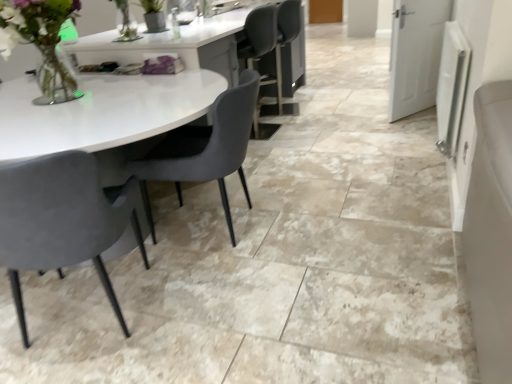
Find the location of a particular element. This screenshot has height=384, width=512. unoccupied region to the right of velvet grey chair at center, the 2th chair in the left-to-right sequence is located at coordinates (312, 213).